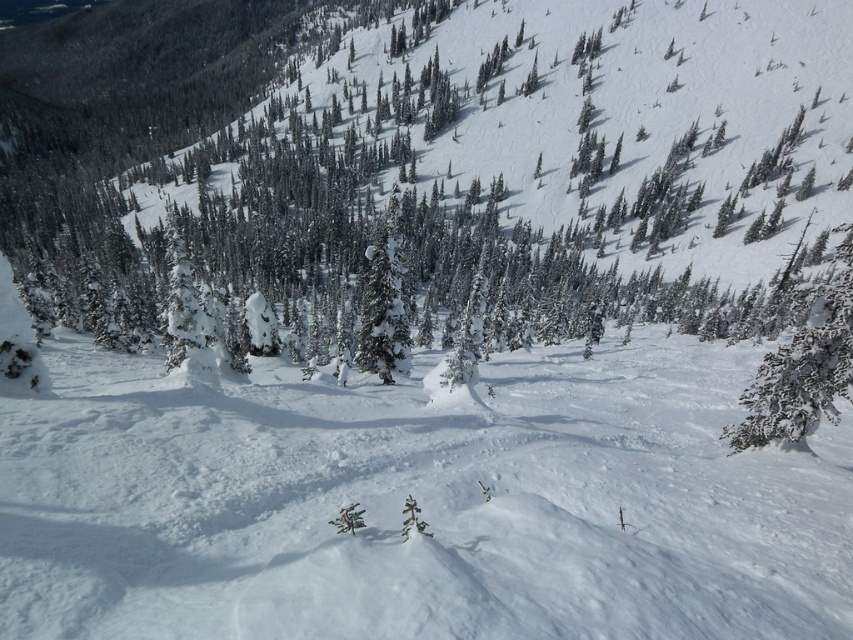
You are standing at the bottom of the slope in the winter landscape and want to reach the point marked as point (399, 346). However, there is an obstacle at point (747, 433). Which point should you avoid to reach your destination safely?

You should avoid point (747, 433) because it is in front of point (399, 346), meaning it lies along the path towards your destination and could block your way.